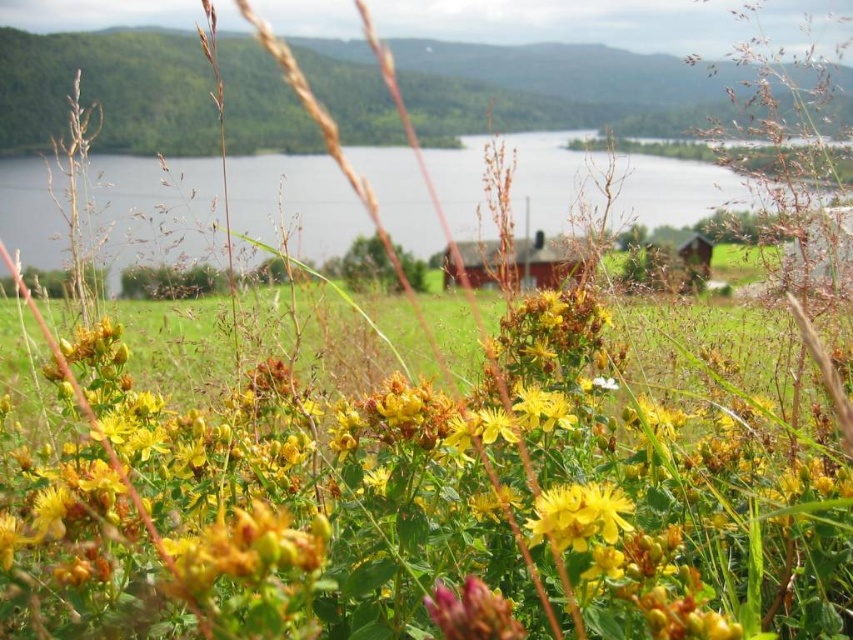
You are a gardener standing in the middle of the field. You see the green leafy grass at center and the yellow matte flower at center. Which one is located to the right?

The yellow matte flower at center is located to the right of the green leafy grass at center.

You are a botanist examining the plants in the image. You need to determine which object is bigger between the green leafy grass at center and the yellow matte flower at center. Which one is larger?

The green leafy grass at center is larger compared to the yellow matte flower at center.